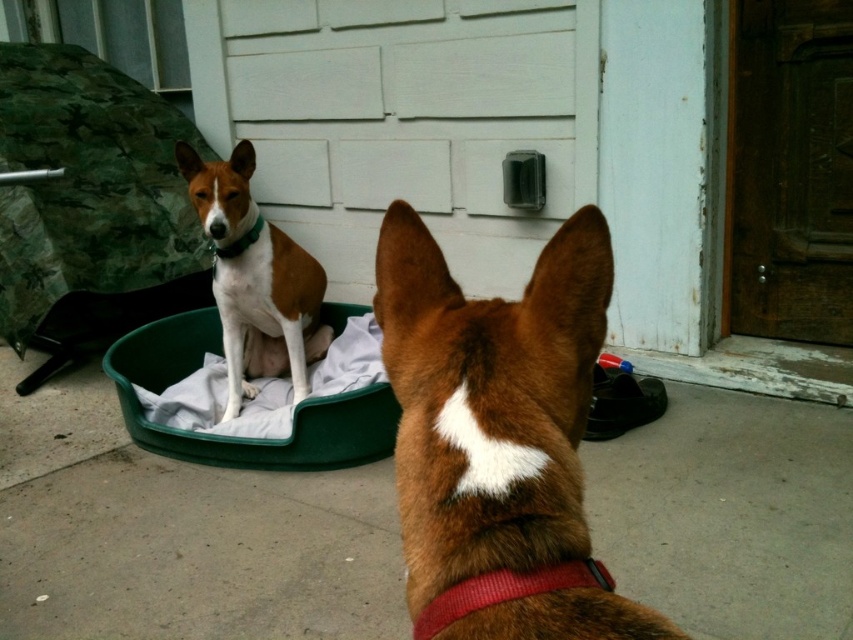
Question: Which of the following is the closest to the observer?

Choices:
 (A) brown/white fur dog at center
 (B) green fabric dog bed at center
 (C) red fabric neckband at center
 (D) brown furry dog at center

Answer: (D)

Question: Does brown/white fur dog at center lie behind green fabric dog bed at center?

Choices:
 (A) yes
 (B) no

Answer: (A)

Question: Among these objects, which one is farthest from the camera?

Choices:
 (A) red fabric neckband at center
 (B) brown furry dog at center

Answer: (A)

Question: Is brown furry dog at center positioned behind brown/white fur dog at center?

Choices:
 (A) yes
 (B) no

Answer: (B)

Question: Which object is positioned farthest from the brown furry dog at center?

Choices:
 (A) green fabric dog bed at center
 (B) red fabric neckband at center
 (C) brown/white fur dog at center

Answer: (C)

Question: Observing the image, what is the correct spatial positioning of brown/white fur dog at center in reference to green fabric dog bed at center?

Choices:
 (A) below
 (B) above

Answer: (B)